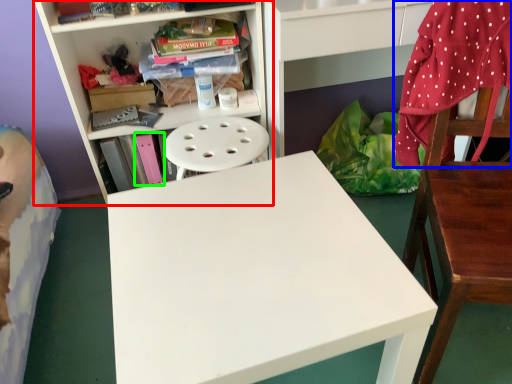
Question: Estimate the real-world distances between objects in this image. Which object is farther from bookcase (highlighted by a red box), blanket (highlighted by a blue box) or book (highlighted by a green box)?

Choices:
 (A) blanket
 (B) book

Answer: (A)